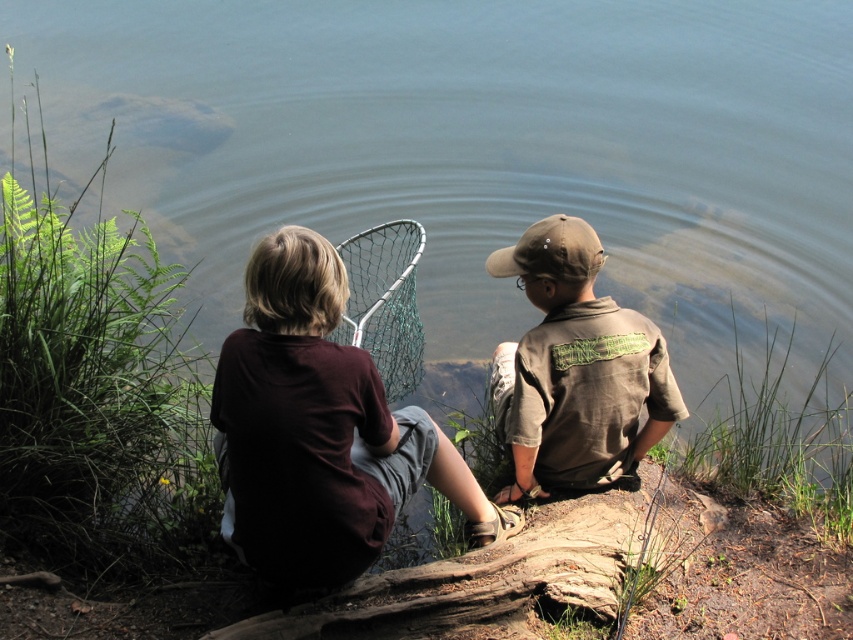
The width and height of the screenshot is (853, 640). In order to click on dark brown shirt at center in this screenshot , I will do `click(320, 429)`.

Between dark brown shirt at center and green mesh fishing net at center, which one is positioned lower?

dark brown shirt at center

Locate an element on the screen. dark brown shirt at center is located at coordinates (320, 429).

Does dark brown shirt at center come in front of brown rough wood log at lower center?

Yes, dark brown shirt at center is in front of brown rough wood log at lower center.

Who is more distant from viewer, (378, 500) or (540, 580)?

The point (540, 580) is more distant.

Which is in front, point (294, 493) or point (401, 618)?

Positioned in front is point (294, 493).

Find the location of a particular element. The image size is (853, 640). dark brown shirt at center is located at coordinates [x=320, y=429].

Who is more distant from viewer, (x=537, y=301) or (x=474, y=614)?

The point (x=537, y=301) is more distant.

Is point (630, 349) less distant than point (619, 531)?

Yes, point (630, 349) is in front of point (619, 531).

Which is behind, point (490, 272) or point (585, 516)?

The point (490, 272) is more distant.

Identify the location of brown cotton shirt at center. (575, 369).